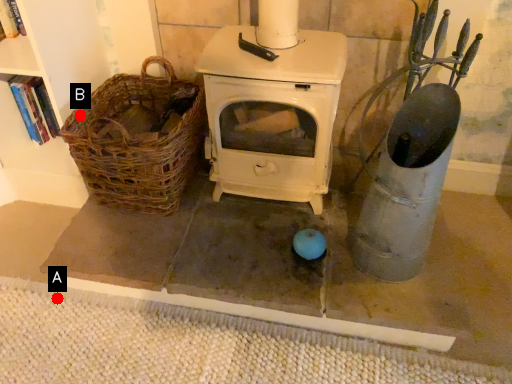
Question: Two points are circled on the image, labeled by A and B beside each circle. Which point is further to the camera?

Choices:
 (A) A is further
 (B) B is further

Answer: (B)